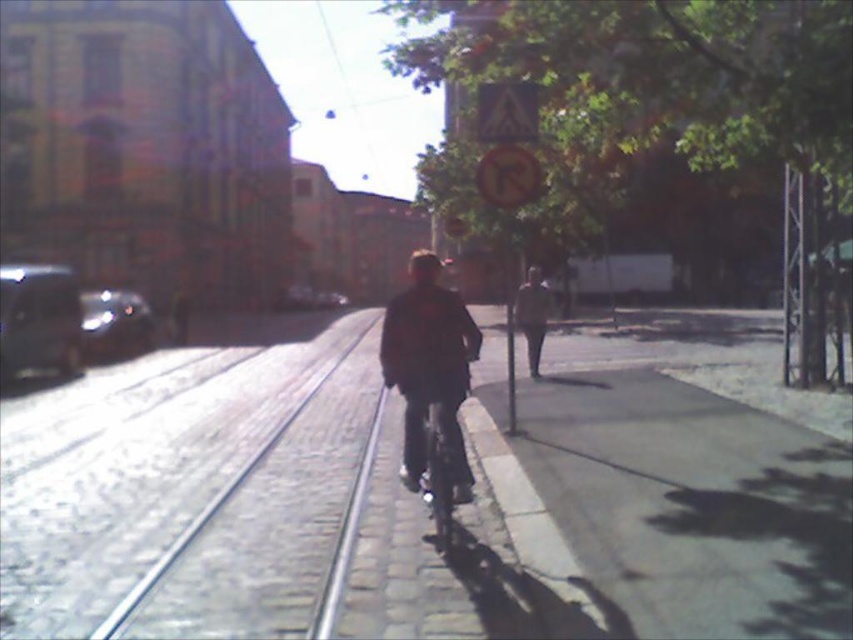
Does gray concrete train track at left appear over dark brown leather jacket at center?

No, gray concrete train track at left is not above dark brown leather jacket at center.

Who is more forward, (x=213, y=499) or (x=541, y=316)?

Point (x=213, y=499)

Find the location of a particular element. The height and width of the screenshot is (640, 853). gray concrete train track at left is located at coordinates (213, 506).

Does gray concrete sidewalk at center appear on the left side of gray concrete train track at left?

No, gray concrete sidewalk at center is not to the left of gray concrete train track at left.

Does gray concrete sidewalk at center have a smaller size compared to gray concrete train track at left?

Correct, gray concrete sidewalk at center occupies less space than gray concrete train track at left.

Is point (521, 456) positioned after point (289, 422)?

That is False.

Where is `gray concrete sidewalk at center`? The image size is (853, 640). gray concrete sidewalk at center is located at coordinates (691, 506).

Is gray concrete sidewalk at center taller than dark brown leather jacket at center?

No.

Does point (555, 412) lie in front of point (525, 292)?

Yes.

Is point (843, 454) closer to viewer compared to point (537, 275)?

That is True.

I want to click on gray concrete sidewalk at center, so click(691, 506).